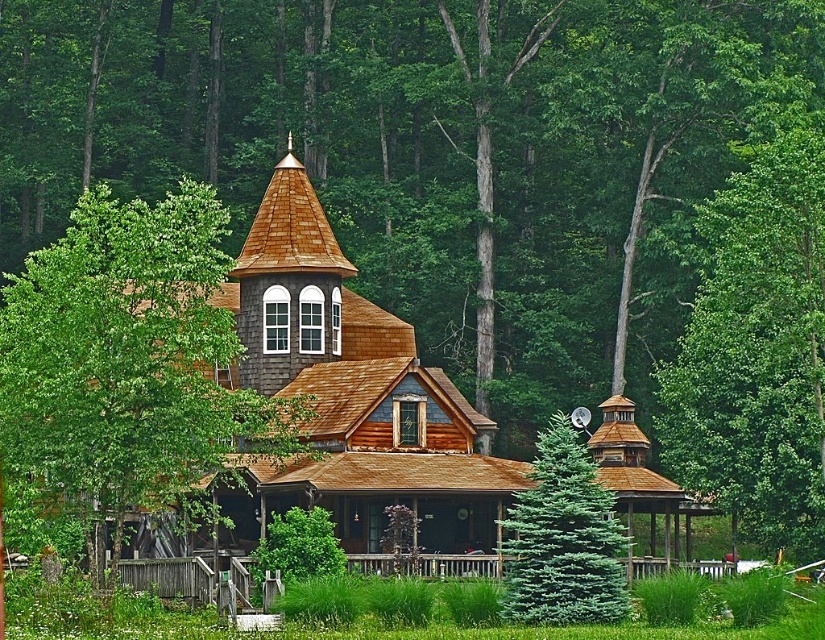
Does green leafy tree at center have a smaller size compared to green fir at center?

No, green leafy tree at center is not smaller than green fir at center.

Image resolution: width=825 pixels, height=640 pixels. I want to click on green leafy tree at center, so click(x=130, y=362).

The height and width of the screenshot is (640, 825). I want to click on green leafy tree at center, so click(x=130, y=362).

This screenshot has height=640, width=825. I want to click on green leafy tree at center, so click(x=130, y=362).

Does point (36, 294) lie behind point (752, 488)?

No, (36, 294) is in front of (752, 488).

Does green leafy tree at center come behind green leafy tree at upper center?

No, green leafy tree at center is in front of green leafy tree at upper center.

The height and width of the screenshot is (640, 825). What do you see at coordinates (130, 362) in the screenshot?
I see `green leafy tree at center` at bounding box center [130, 362].

Image resolution: width=825 pixels, height=640 pixels. Identify the location of green leafy tree at center. (130, 362).

Is green leafy tree at upper center bigger than green fir at center?

Yes, green leafy tree at upper center is bigger than green fir at center.

From the picture: Does green leafy tree at upper center lie in front of green fir at center?

That is False.

Does point (713, 486) lie in front of point (571, 428)?

Yes, it is in front of point (571, 428).

You are a GUI agent. You are given a task and a screenshot of the screen. Output one action in this format:
    pyautogui.click(x=<x>, y=<y>)
    Task: Click on the green leafy tree at upper center
    The height and width of the screenshot is (640, 825).
    Given the screenshot: What is the action you would take?
    pyautogui.click(x=755, y=348)